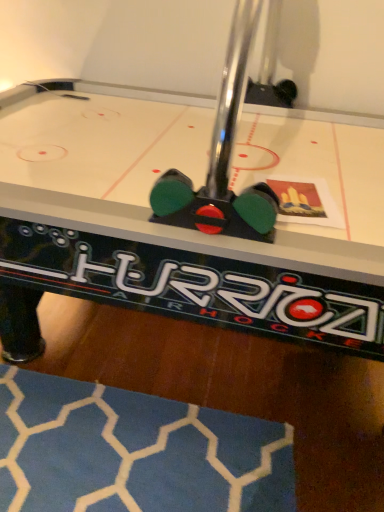
The image size is (384, 512). I want to click on free area behind blue fabric rug at lower left, so click(x=140, y=351).